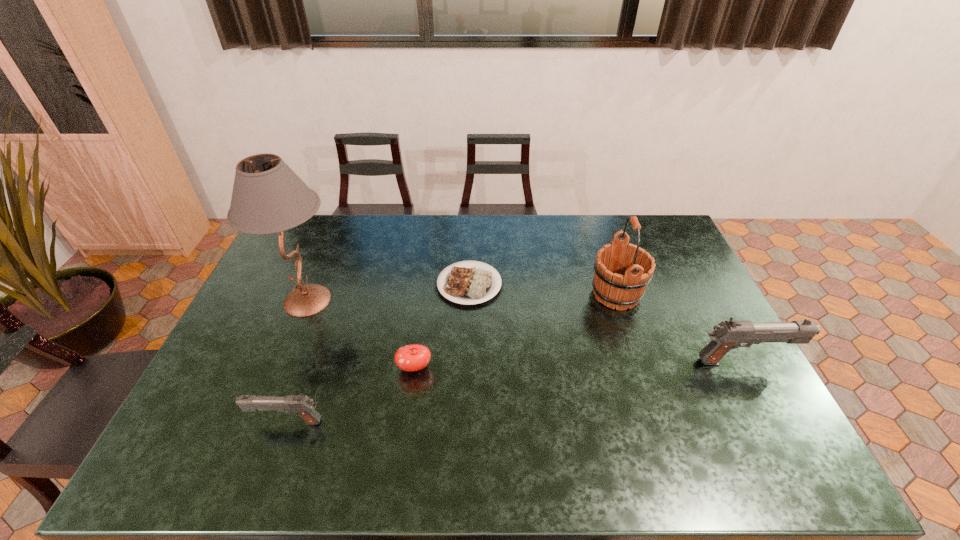
You are a GUI agent. You are given a task and a screenshot of the screen. Output one action in this format:
    pyautogui.click(x=<x>, y=<y>)
    Task: Click on the free space at the near edge
    
    Given the screenshot: What is the action you would take?
    pyautogui.click(x=703, y=428)

In the image, there is a desktop. At what (x,y) coordinates should I click in order to perform the action: click on vacant area at the left edge. Please return your answer as a coordinate pair (x, y). The height and width of the screenshot is (540, 960). Looking at the image, I should click on (302, 275).

I want to click on free space at the right edge of the desktop, so click(715, 316).

Locate an element on the screen. vacant space at the far left corner of the desktop is located at coordinates (301, 231).

Identify the location of blank space at the near right corner of the desktop. (741, 411).

You are a GUI agent. You are given a task and a screenshot of the screen. Output one action in this format:
    pyautogui.click(x=<x>, y=<y>)
    Task: Click on the vacant area between the fifth object from left to right and the nearest object
    
    Given the screenshot: What is the action you would take?
    pyautogui.click(x=452, y=358)

Where is `unoccupied position between the apple and the tallest object`? unoccupied position between the apple and the tallest object is located at coordinates (361, 334).

The width and height of the screenshot is (960, 540). Identify the location of vacant space that's between the apple and the table lamp. (361, 334).

Locate an element on the screen. The height and width of the screenshot is (540, 960). free spot between the wine bucket and the right gun is located at coordinates (680, 328).

What are the coordinates of `empty location between the nearer gun and the fifth shortest object` in the screenshot? It's located at (452, 358).